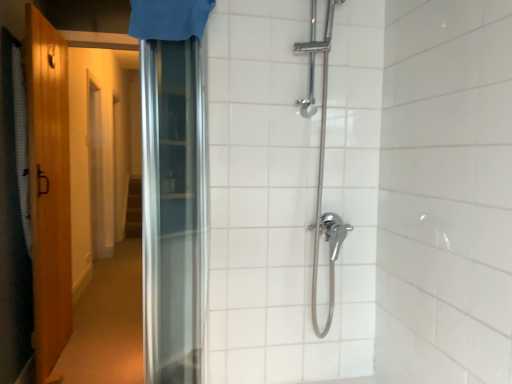
Question: Could you tell me if wooden door at left is turned towards white textured shower curtain at left, acting as the 1th shower curtain starting from the bottom?

Choices:
 (A) yes
 (B) no

Answer: (A)

Question: Considering the relative positions of wooden door at left and white textured shower curtain at left, the first shower curtain when ordered from back to front, in the image provided, is wooden door at left to the right of white textured shower curtain at left, the first shower curtain when ordered from back to front, from the viewer's perspective?

Choices:
 (A) no
 (B) yes

Answer: (B)

Question: From a real-world perspective, is wooden door at left under white textured shower curtain at left, which is the second shower curtain from right to left?

Choices:
 (A) yes
 (B) no

Answer: (A)

Question: Is white textured shower curtain at left, arranged as the 2th shower curtain when viewed from the front, at the back of wooden door at left?

Choices:
 (A) no
 (B) yes

Answer: (B)

Question: Does wooden door at left have a larger size compared to white textured shower curtain at left, acting as the 1th shower curtain starting from the bottom?

Choices:
 (A) yes
 (B) no

Answer: (A)

Question: Considering the positions of wooden door at left and white textured shower curtain at left, arranged as the 2th shower curtain when viewed from the top, in the image, is wooden door at left wider or thinner than white textured shower curtain at left, arranged as the 2th shower curtain when viewed from the top,?

Choices:
 (A) wide
 (B) thin

Answer: (A)

Question: Considering the positions of wooden door at left and white textured shower curtain at left, which is the second shower curtain from right to left, in the image, is wooden door at left bigger or smaller than white textured shower curtain at left, which is the second shower curtain from right to left,?

Choices:
 (A) small
 (B) big

Answer: (B)

Question: Is wooden door at left in front of or behind white textured shower curtain at left, the 1th shower curtain positioned from the left, in the image?

Choices:
 (A) front
 (B) behind

Answer: (A)

Question: From the image's perspective, is wooden door at left above or below white textured shower curtain at left, arranged as the 2th shower curtain when viewed from the front?

Choices:
 (A) above
 (B) below

Answer: (B)

Question: In terms of height, does blue fabric shower curtain at upper center, which is the first shower curtain from front to back, look taller or shorter compared to wooden door at left?

Choices:
 (A) short
 (B) tall

Answer: (A)

Question: Considering their positions, is blue fabric shower curtain at upper center, which is the first shower curtain from front to back, located in front of or behind wooden door at left?

Choices:
 (A) behind
 (B) front

Answer: (B)

Question: Considering the positions of point (173, 0) and point (35, 62), is point (173, 0) closer or farther from the camera than point (35, 62)?

Choices:
 (A) closer
 (B) farther

Answer: (A)

Question: Visually, is blue fabric shower curtain at upper center, which is the 1th shower curtain in top-to-bottom order, positioned to the left or to the right of wooden door at left?

Choices:
 (A) left
 (B) right

Answer: (B)

Question: Is point (23, 115) closer or farther from the camera than point (181, 16)?

Choices:
 (A) closer
 (B) farther

Answer: (B)

Question: From the image's perspective, is white textured shower curtain at left, which is the second shower curtain from right to left, located above or below blue fabric shower curtain at upper center, which is the first shower curtain from front to back?

Choices:
 (A) below
 (B) above

Answer: (A)